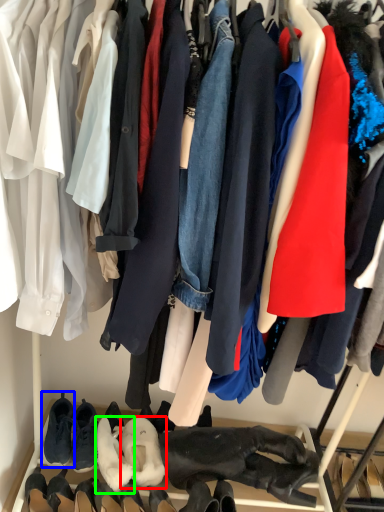
Question: Considering the real-world distances, which object is farthest from footwear (highlighted by a red box)? footwear (highlighted by a blue box) or footwear (highlighted by a green box)?

Choices:
 (A) footwear
 (B) footwear

Answer: (A)